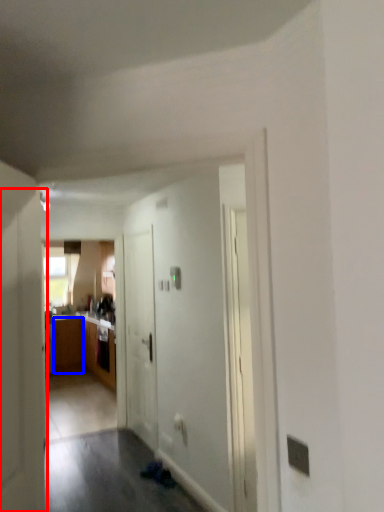
Question: Among these objects, which one is nearest to the camera, door (highlighted by a red box) or cabinetry (highlighted by a blue box)?

Choices:
 (A) door
 (B) cabinetry

Answer: (A)